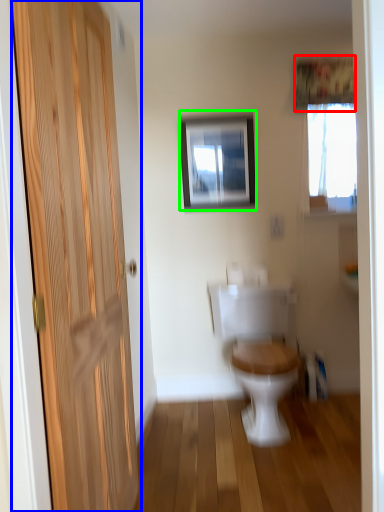
Question: Considering the real-world distances, which object is closest to curtain (highlighted by a red box)? door (highlighted by a blue box) or picture frame (highlighted by a green box).

Choices:
 (A) door
 (B) picture frame

Answer: (B)